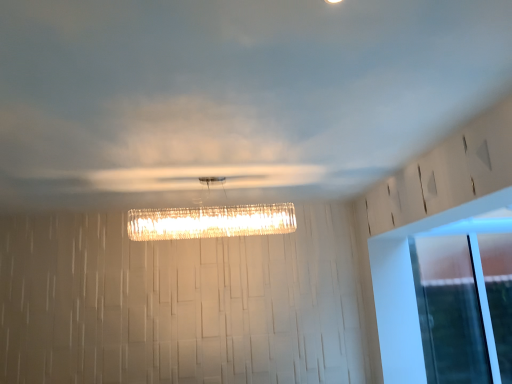
Question: In which direction should I rotate to look at translucent glass rectangular light fixture at center?

Choices:
 (A) right
 (B) left

Answer: (B)